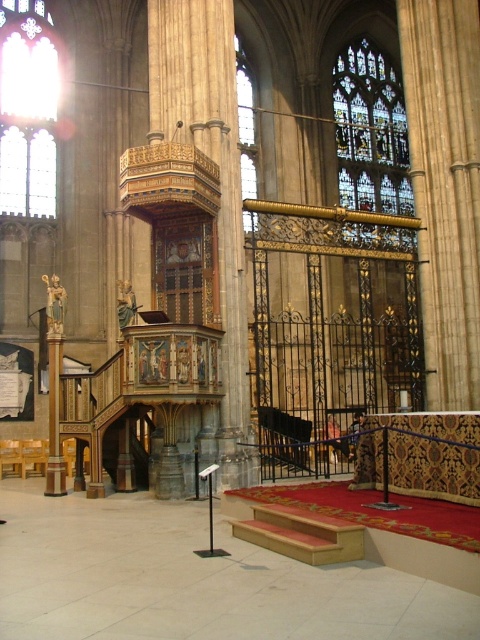
Does stained glass at upper center appear under clear stained glass at upper center?

Yes, stained glass at upper center is below clear stained glass at upper center.

Does stained glass at upper center appear over clear stained glass at upper center?

No.

Does point (383, 90) come farther from viewer compared to point (247, 81)?

Yes, it is behind point (247, 81).

The width and height of the screenshot is (480, 640). I want to click on stained glass at upper center, so click(x=371, y=132).

Can you confirm if clear stained glass at upper left is positioned below clear stained glass at upper center?

No.

The width and height of the screenshot is (480, 640). What do you see at coordinates (27, 108) in the screenshot?
I see `clear stained glass at upper left` at bounding box center [27, 108].

Is point (40, 209) positioned after point (250, 76)?

No, (40, 209) is closer to viewer.

Image resolution: width=480 pixels, height=640 pixels. What are the coordinates of `clear stained glass at upper left` in the screenshot? It's located at (27, 108).

Is clear stained glass at upper left smaller than stained glass at upper center?

Yes, clear stained glass at upper left is smaller than stained glass at upper center.

Does clear stained glass at upper left have a greater height compared to stained glass at upper center?

In fact, clear stained glass at upper left may be shorter than stained glass at upper center.

Locate an element on the screen. Image resolution: width=480 pixels, height=640 pixels. clear stained glass at upper left is located at coordinates (27, 108).

Where is `clear stained glass at upper left`? clear stained glass at upper left is located at coordinates (27, 108).